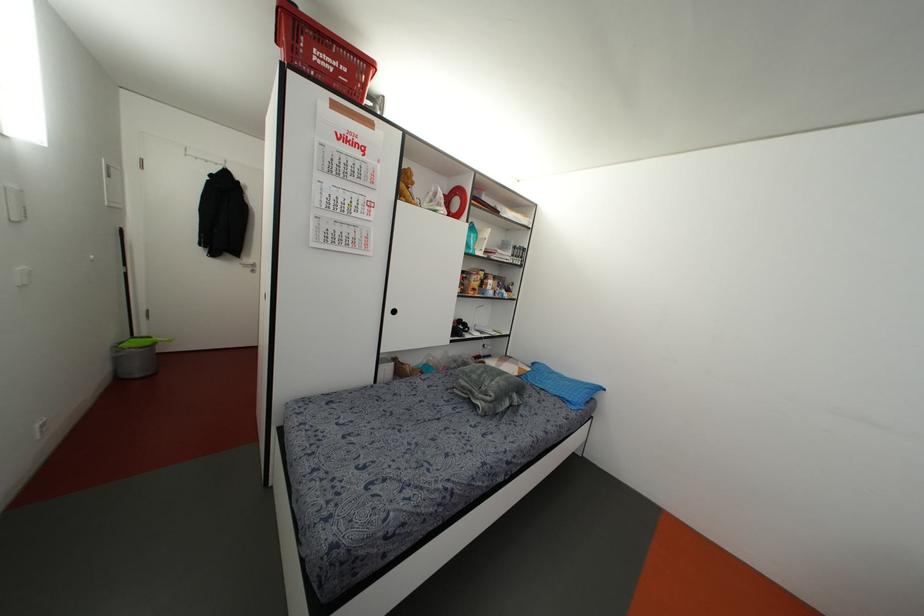
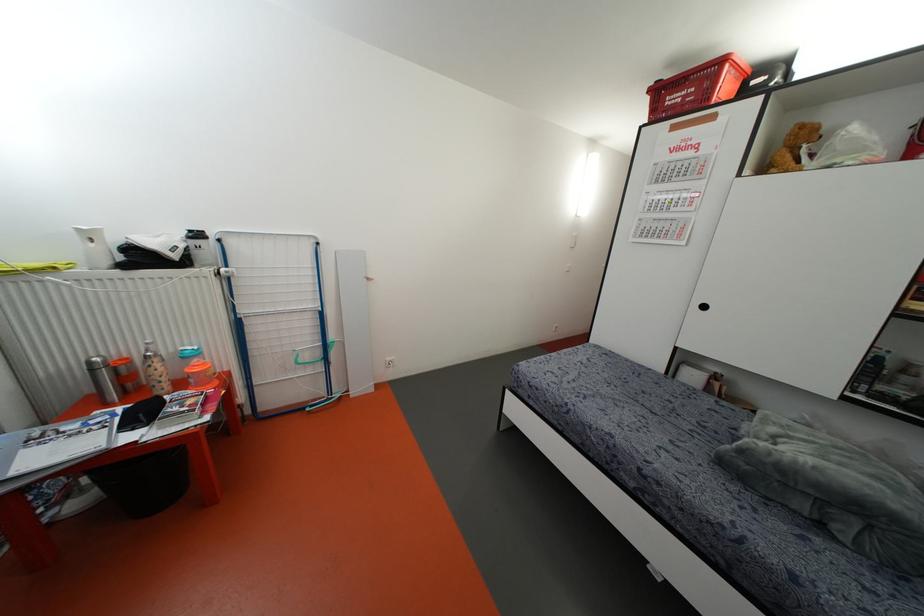
In the second image, find the point that corresponds to (x=394, y=310) in the first image.

(703, 307)